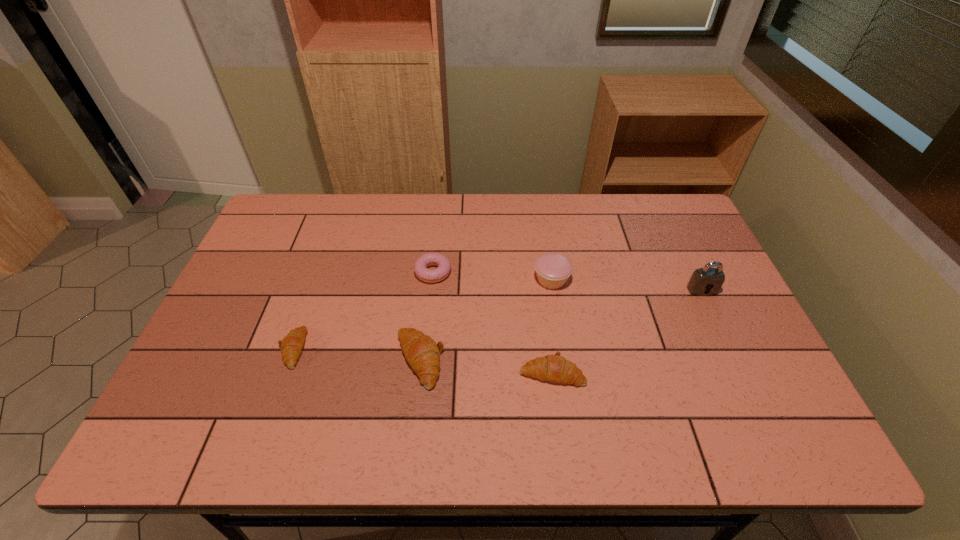
All crescent rolls are currently evenly spaced. To continue this pattern, where would you add another crescent roll on the right? Please point out a vacant spot. Please provide its 2D coordinates. Your answer should be formatted as a tuple, i.e. [(x, y)], where the tuple contains the x and y coordinates of a point satisfying the conditions above.

[(690, 386)]